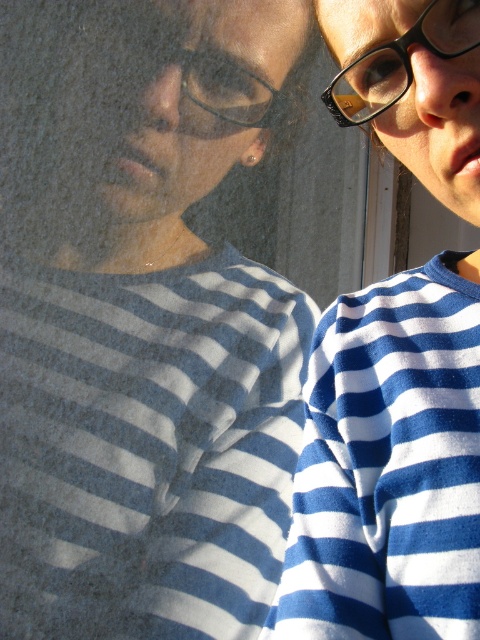
Is blue striped shirt at center smaller than black plastic glasses at upper center?

No, blue striped shirt at center is not smaller than black plastic glasses at upper center.

Does blue striped shirt at center appear over black plastic glasses at upper center?

Actually, blue striped shirt at center is below black plastic glasses at upper center.

Describe the element at coordinates (142, 321) in the screenshot. I see `blue striped shirt at center` at that location.

I want to click on blue striped shirt at center, so click(142, 321).

Is blue striped shirt at center closer to camera compared to blue striped sweater at center?

That is False.

The image size is (480, 640). Identify the location of blue striped shirt at center. (142, 321).

Which is more to the right, blue striped shirt at center or black plastic glasses at upper right?

black plastic glasses at upper right is more to the right.

Locate an element on the screen. blue striped shirt at center is located at coordinates (142, 321).